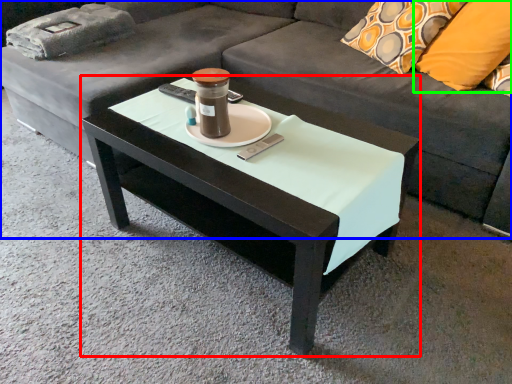
Question: Which object is positioned farthest from coffee table (highlighted by a red box)? Select from studio couch (highlighted by a blue box) and pillow (highlighted by a green box).

Choices:
 (A) studio couch
 (B) pillow

Answer: (B)